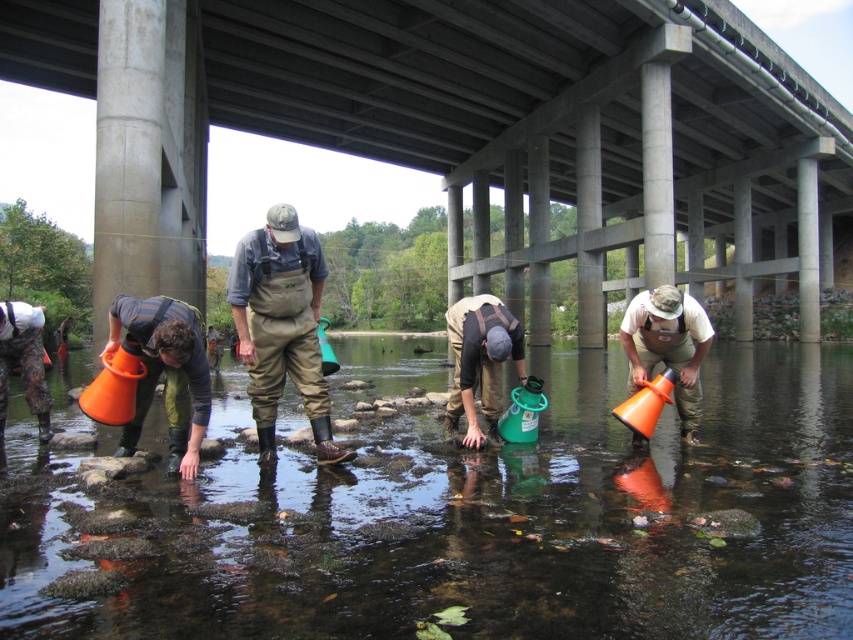
Question: Can you confirm if concrete bridge at center is thinner than khaki waterproof overalls at center?

Choices:
 (A) yes
 (B) no

Answer: (B)

Question: Which of the following is the closest to the observer?

Choices:
 (A) camo pants at lower left
 (B) concrete bridge at center
 (C) orange plastic bucket at center

Answer: (C)

Question: Which object appears closest to the camera in this image?

Choices:
 (A) orange plastic bucket at center
 (B) matte green bucket at center

Answer: (A)

Question: From the image, what is the correct spatial relationship of concrete bridge at center in relation to khaki waterproof overalls at center?

Choices:
 (A) below
 (B) above

Answer: (B)

Question: Among these objects, which one is farthest from the camera?

Choices:
 (A) matte green bucket at center
 (B) orange plastic bucket at center

Answer: (A)

Question: Does khaki waterproof overalls at center appear under matte green bucket at center?

Choices:
 (A) no
 (B) yes

Answer: (A)